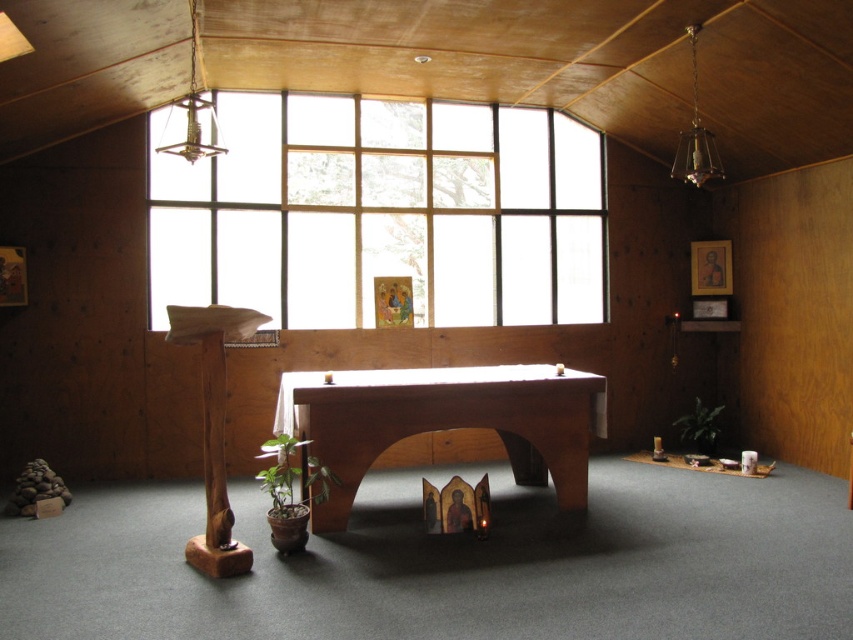
Question: Does clear glass window at upper center lie behind wooden table at center?

Choices:
 (A) yes
 (B) no

Answer: (A)

Question: Which point is closer to the camera taking this photo?

Choices:
 (A) (428, 308)
 (B) (358, 392)

Answer: (B)

Question: Can you confirm if clear glass window at upper center is positioned below wooden table at center?

Choices:
 (A) no
 (B) yes

Answer: (A)

Question: Can you confirm if clear glass window at upper center is bigger than wooden table at center?

Choices:
 (A) no
 (B) yes

Answer: (B)

Question: Which point is closer to the camera?

Choices:
 (A) clear glass window at upper center
 (B) wooden table at center

Answer: (B)

Question: Which of the following is the closest to the observer?

Choices:
 (A) wooden table at center
 (B) clear glass window at upper center

Answer: (A)